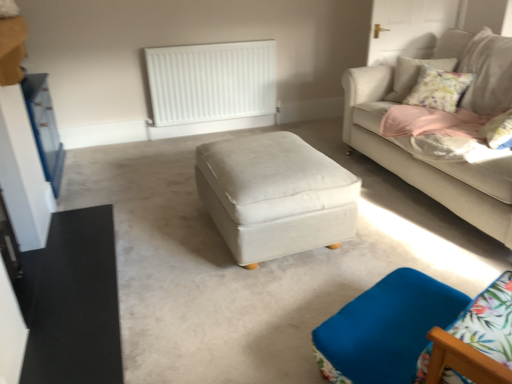
Question: Considering the relative sizes of satin white ottoman at center and white matte radiator at upper center in the image provided, is satin white ottoman at center taller than white matte radiator at upper center?

Choices:
 (A) no
 (B) yes

Answer: (A)

Question: Is satin white ottoman at center oriented towards white matte radiator at upper center?

Choices:
 (A) yes
 (B) no

Answer: (B)

Question: Is satin white ottoman at center directly adjacent to white matte radiator at upper center?

Choices:
 (A) no
 (B) yes

Answer: (A)

Question: From the image's perspective, would you say satin white ottoman at center is shown under white matte radiator at upper center?

Choices:
 (A) no
 (B) yes

Answer: (B)

Question: Would you say satin white ottoman at center is outside white matte radiator at upper center?

Choices:
 (A) no
 (B) yes

Answer: (B)

Question: From a real-world perspective, relative to blue fabric swivel chair at lower right, is light beige fabric couch at upper right vertically above or below?

Choices:
 (A) below
 (B) above

Answer: (B)

Question: Is light beige fabric couch at upper right to the left or to the right of blue fabric swivel chair at lower right in the image?

Choices:
 (A) right
 (B) left

Answer: (A)

Question: From the image's perspective, is light beige fabric couch at upper right located above or below blue fabric swivel chair at lower right?

Choices:
 (A) above
 (B) below

Answer: (A)

Question: Is light beige fabric couch at upper right in front of or behind blue fabric swivel chair at lower right in the image?

Choices:
 (A) behind
 (B) front

Answer: (A)

Question: From a real-world perspective, is blue fabric swivel chair at lower right positioned above or below light beige fabric couch at upper right?

Choices:
 (A) above
 (B) below

Answer: (B)

Question: Considering the positions of point (416, 340) and point (372, 94), is point (416, 340) closer or farther from the camera than point (372, 94)?

Choices:
 (A) farther
 (B) closer

Answer: (B)

Question: Would you say blue fabric swivel chair at lower right is to the left or to the right of light beige fabric couch at upper right in the picture?

Choices:
 (A) right
 (B) left

Answer: (B)

Question: Is blue fabric swivel chair at lower right bigger or smaller than light beige fabric couch at upper right?

Choices:
 (A) big
 (B) small

Answer: (B)

Question: From the image's perspective, is satin white ottoman at center positioned above or below blue fabric swivel chair at lower right?

Choices:
 (A) below
 (B) above

Answer: (B)

Question: In the image, is satin white ottoman at center positioned in front of or behind blue fabric swivel chair at lower right?

Choices:
 (A) front
 (B) behind

Answer: (B)